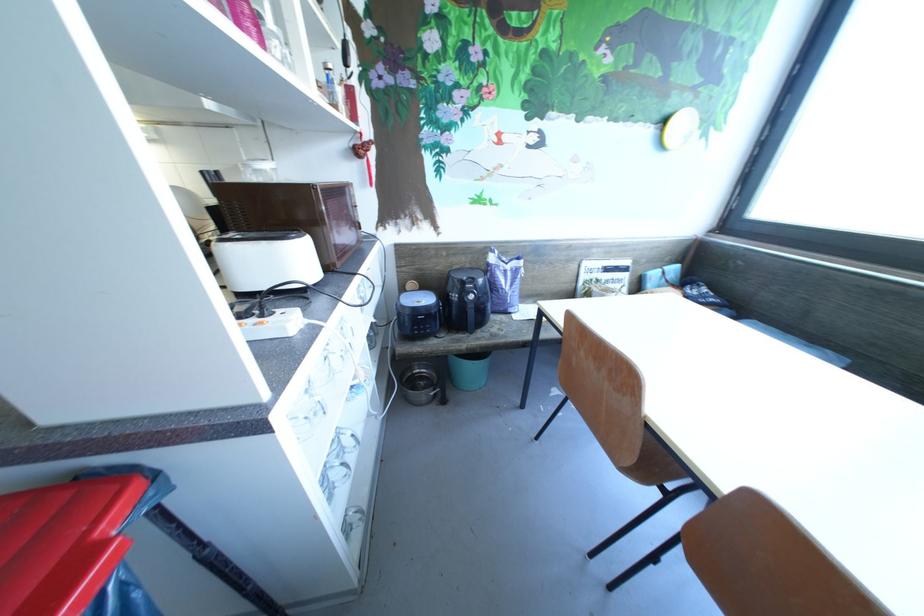
Where would you lift the red trash can lid? Please return your answer as a coordinate pair (x, y).

(75, 546)